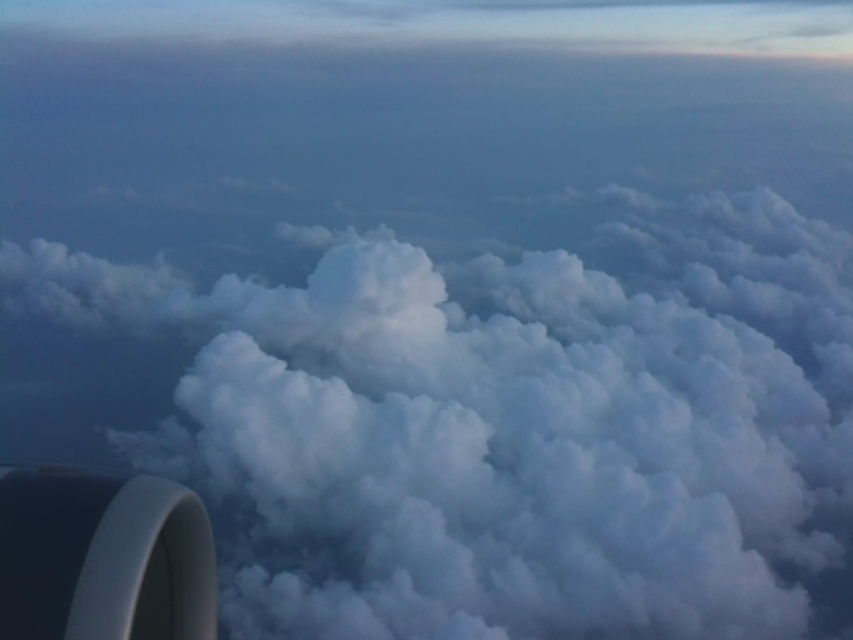
Question: Among these points, which one is farthest from the camera?

Choices:
 (A) (119, 572)
 (B) (86, 304)

Answer: (B)

Question: Is white fluffy cloud at center above white matte engine at bottom left?

Choices:
 (A) no
 (B) yes

Answer: (A)

Question: Is white fluffy cloud at center to the right of white matte engine at bottom left from the viewer's perspective?

Choices:
 (A) no
 (B) yes

Answer: (B)

Question: Is white fluffy cloud at center thinner than white matte engine at bottom left?

Choices:
 (A) no
 (B) yes

Answer: (A)